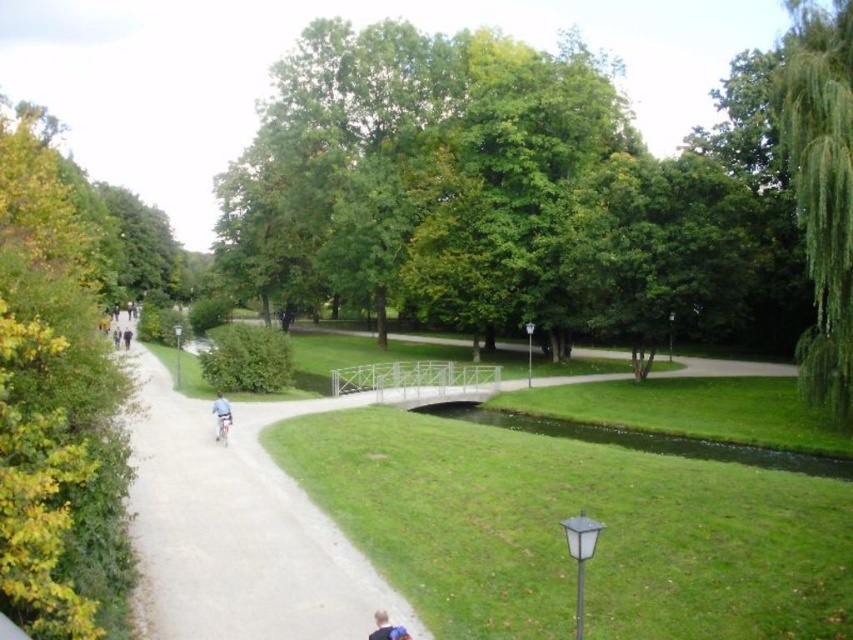
You are walking along the park pathway and see the green leafy tree at upper right and the blue fabric shirt at center. Which object is larger in size?

The green leafy tree at upper right is bigger than the blue fabric shirt at center.

You are standing on the paved pathway in the park and see two green leafy trees. One is labeled as the green leafy tree at center, and the other is the green leafy tree at left. From your position on the path, which tree is closer to your left side?

The green leafy tree at left is closer to your left side because it is positioned to the left of the green leafy tree at center.

From the picture: You are a cyclist riding a light blue metallic bicycle at center in the park. You want to take a photo of the green leafy tree at center from the ground level. Is the tree visible from your current position on the bicycle?

The green leafy tree at center is above the light blue metallic bicycle at center, so yes, the cyclist can see the tree from ground level as it is positioned above the bicycle.